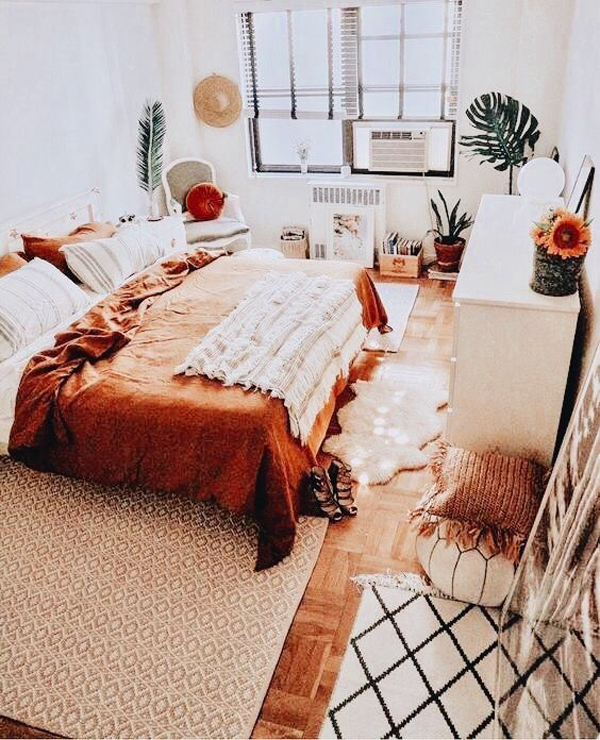
Image resolution: width=600 pixels, height=740 pixels. I want to click on black border on rug, so click(408, 653).